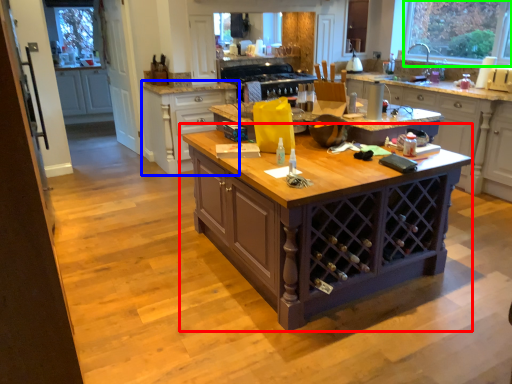
Question: Which object is the closest to the table (highlighted by a red box)? Choose among these: cabinetry (highlighted by a blue box) or window (highlighted by a green box).

Choices:
 (A) cabinetry
 (B) window

Answer: (A)